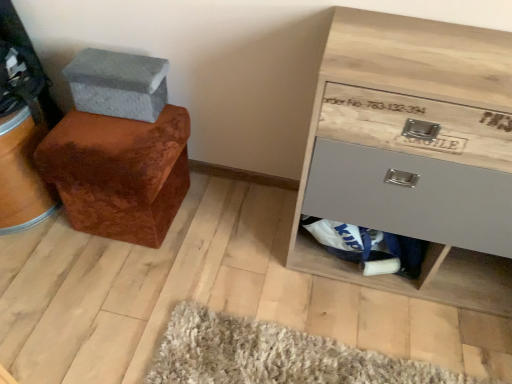
The image size is (512, 384). I want to click on free space in front of matte gray drawer at lower right, so click(x=369, y=312).